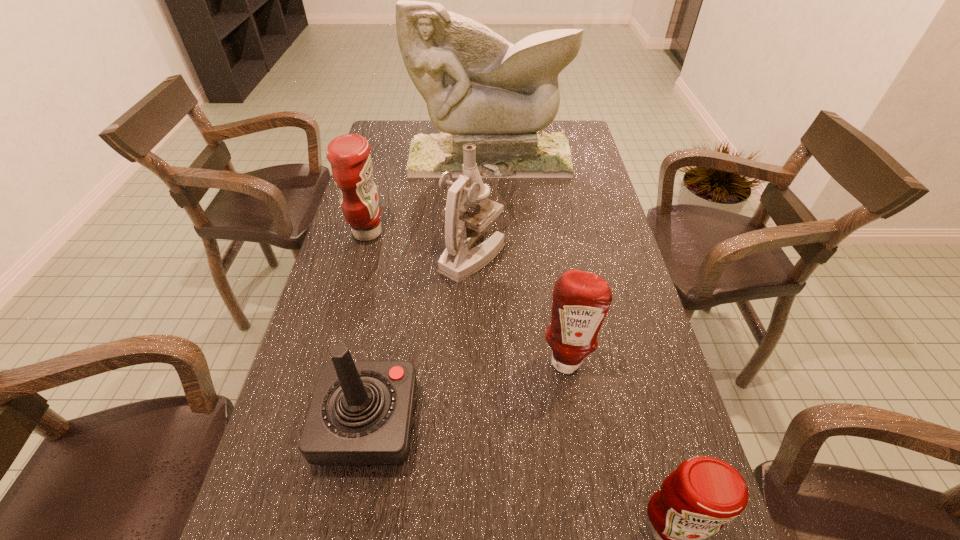
Locate an element on the screen. free space located on the left of the second nearest condiment is located at coordinates (444, 360).

Find the location of a particular element. This screenshot has height=540, width=960. vacant space located 0.110m on the front-facing side of the joystick is located at coordinates (469, 423).

Locate an element on the screen. The width and height of the screenshot is (960, 540). object at the far edge is located at coordinates (480, 89).

Image resolution: width=960 pixels, height=540 pixels. Find the location of `sculpture positioned at the left edge`. sculpture positioned at the left edge is located at coordinates (480, 89).

The image size is (960, 540). I want to click on condiment present at the left edge, so click(x=349, y=155).

Image resolution: width=960 pixels, height=540 pixels. What are the coordinates of `joystick present at the left edge` in the screenshot? It's located at (361, 412).

You are a GUI agent. You are given a task and a screenshot of the screen. Output one action in this format:
    pyautogui.click(x=<x>, y=<y>)
    Task: Click on the sculpture that is at the right edge
    The height and width of the screenshot is (540, 960).
    Given the screenshot: What is the action you would take?
    coord(480,89)

You are a GUI agent. You are given a task and a screenshot of the screen. Output one action in this format:
    pyautogui.click(x=<x>, y=<y>)
    Task: Click on the condiment at the right edge
    This screenshot has width=960, height=540.
    Given the screenshot: What is the action you would take?
    pyautogui.click(x=581, y=300)

Locate an element on the screen. This screenshot has height=540, width=960. object that is at the far left corner is located at coordinates (480, 89).

In order to click on object that is at the far right corner in this screenshot , I will do `click(480, 89)`.